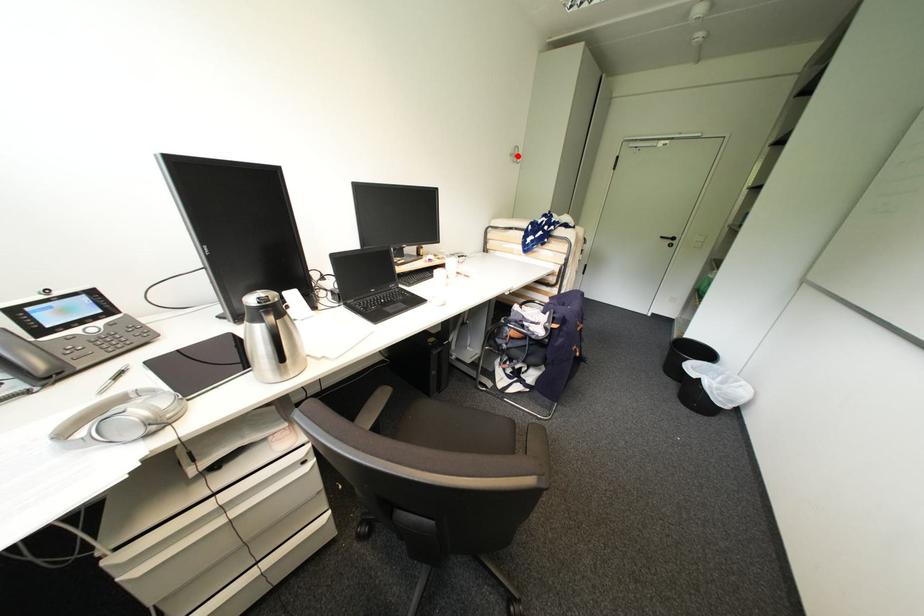
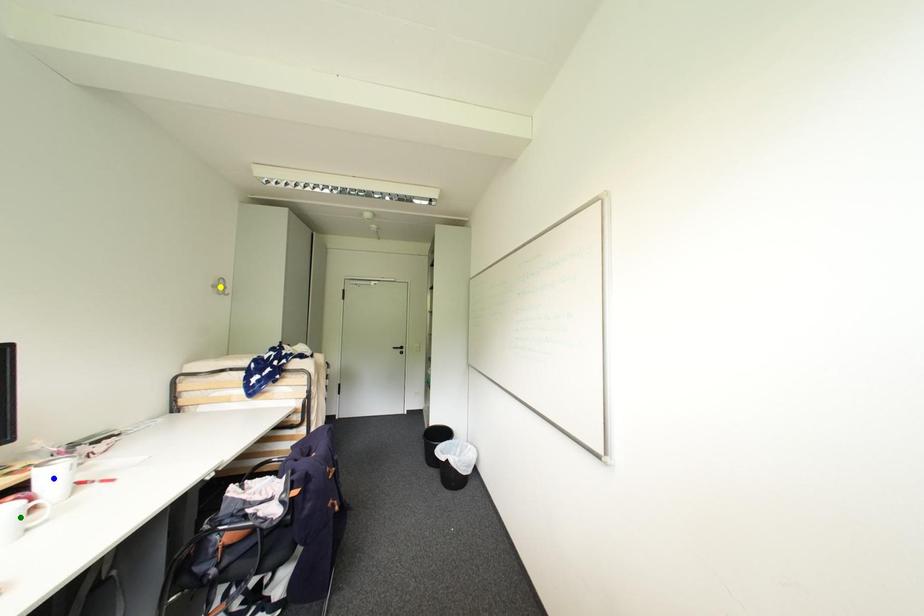
Question: I am providing you with two images of the same scene from different viewpoints. A red point is marked on the first image. You are given multiple points on the second image. Which point in image 2 is actually the same real-world point as the red point in image 1?

Choices:
 (A) yellow point
 (B) blue point
 (C) green point

Answer: (A)